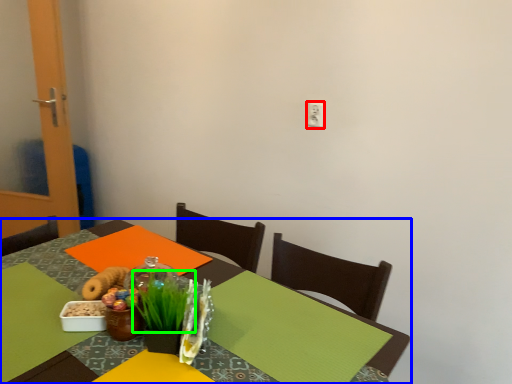
Question: Based on their relative distances, which object is nearer to electric outlet (highlighted by a red box)? Choose from table (highlighted by a blue box) and grass (highlighted by a green box).

Choices:
 (A) table
 (B) grass

Answer: (A)